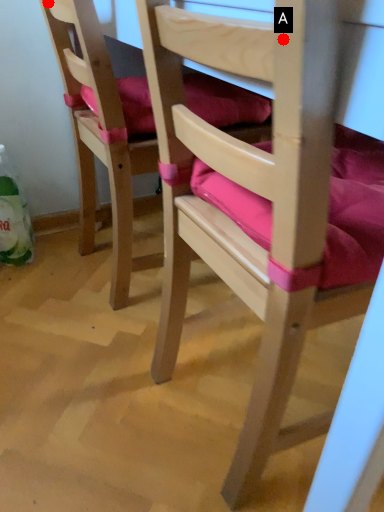
Question: Two points are circled on the image, labeled by A and B beside each circle. Which point is farther from the camera taking this photo?

Choices:
 (A) A is further
 (B) B is further

Answer: (B)